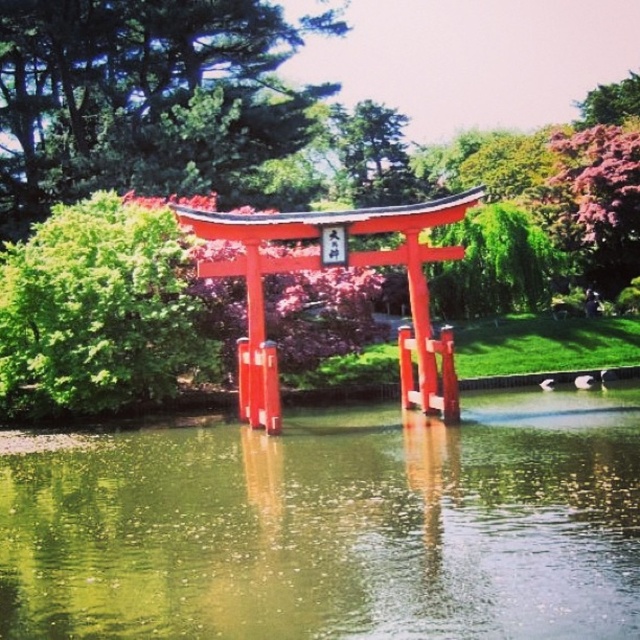
Question: Is green reflective water at center above green leafy tree at upper center?

Choices:
 (A) no
 (B) yes

Answer: (A)

Question: Is green leafy bush at left to the left of purple leafy tree at upper right from the viewer's perspective?

Choices:
 (A) no
 (B) yes

Answer: (B)

Question: Which of the following is the farthest from the observer?

Choices:
 (A) (572, 246)
 (B) (145, 624)
 (C) (628, 84)
 (D) (131, 376)

Answer: (C)

Question: Estimate the real-world distances between objects in this image. Which object is farther from the green leafy tree at upper center?

Choices:
 (A) green reflective water at center
 (B) purple leafy tree at upper right
 (C) green leafy bush at left
 (D) pink textured foliage at upper right

Answer: (D)

Question: Which of the following is the closest to the observer?

Choices:
 (A) pink textured foliage at upper right
 (B) green leafy bush at left
 (C) purple leafy tree at upper right

Answer: (B)

Question: Can you confirm if green leafy bush at left is smaller than purple leafy tree at upper right?

Choices:
 (A) yes
 (B) no

Answer: (A)